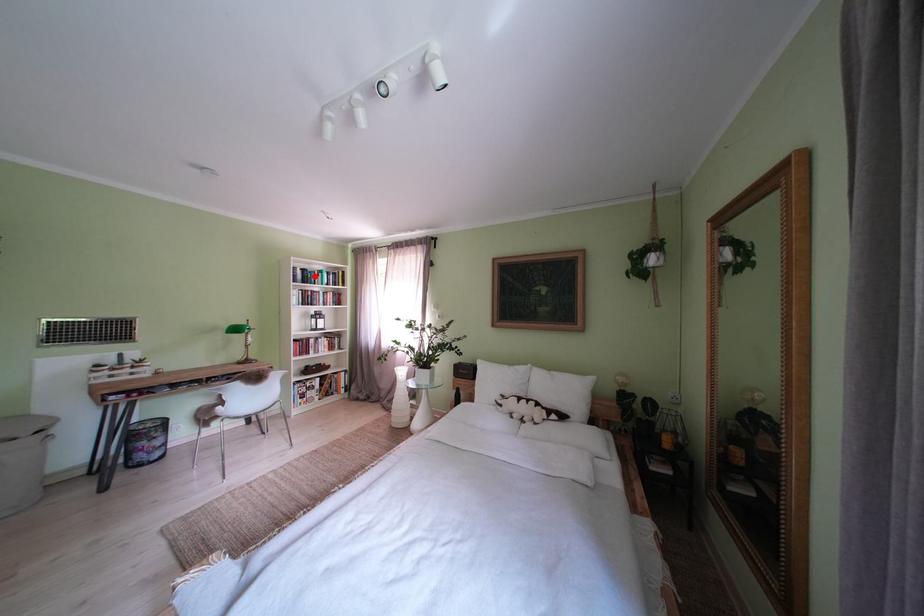
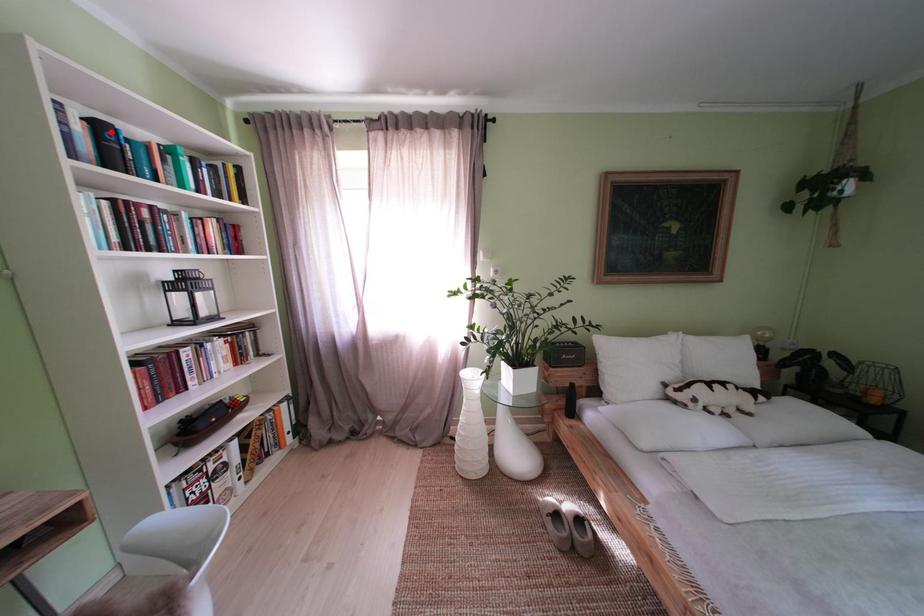
I am providing you with two images of the same scene from different viewpoints. A red point is marked on the first image and another point is marked on the second image. Do the highlighted points in image1 and image2 indicate the same real-world spot?

Yes